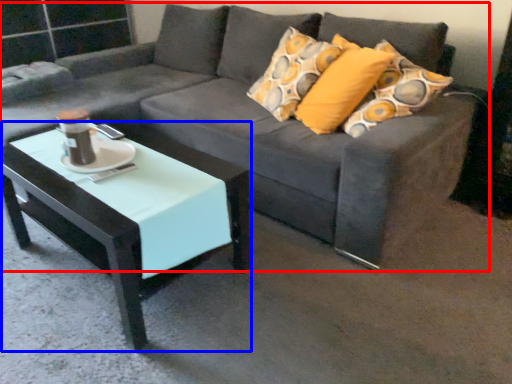
Question: Among these objects, which one is farthest to the camera, studio couch (highlighted by a red box) or coffee table (highlighted by a blue box)?

Choices:
 (A) studio couch
 (B) coffee table

Answer: (B)